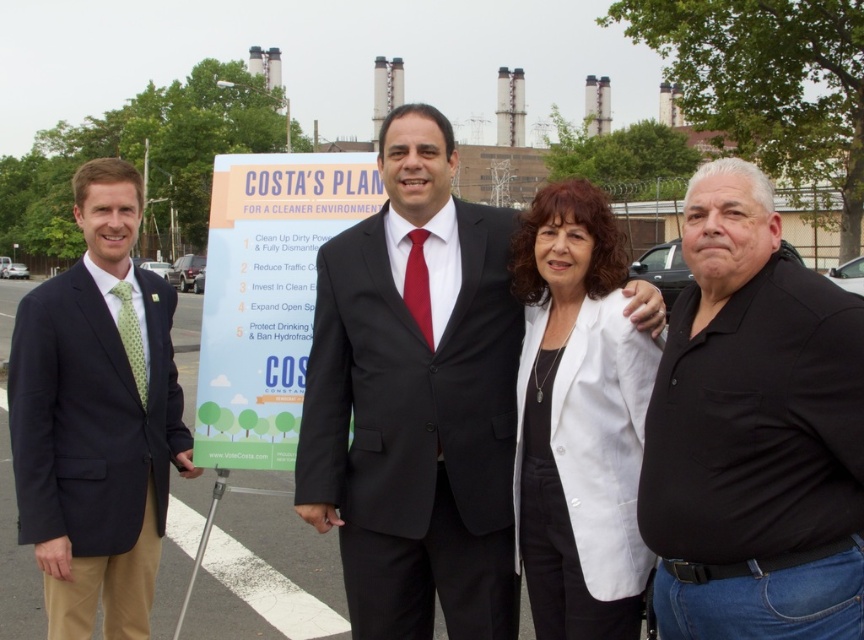
Consider the image. Which is below, matte black suit at center or black cotton polo shirt at right?

matte black suit at center is lower down.

Does matte black suit at center appear over black cotton polo shirt at right?

Actually, matte black suit at center is below black cotton polo shirt at right.

Between point (405, 314) and point (769, 628), which one is positioned in front?

Point (769, 628) is more forward.

The image size is (864, 640). I want to click on matte black suit at center, so click(x=416, y=400).

Which is behind, point (770, 588) or point (276, 458)?

Positioned behind is point (276, 458).

Between black cotton polo shirt at right and white paper sign at center, which one has more height?

With more height is white paper sign at center.

Is point (811, 508) farther from viewer compared to point (308, 230)?

That is False.

Where is `black cotton polo shirt at right`? This screenshot has height=640, width=864. black cotton polo shirt at right is located at coordinates (754, 433).

Is black cotton polo shirt at right to the right of matte green tie at left from the viewer's perspective?

Yes, black cotton polo shirt at right is to the right of matte green tie at left.

Can you confirm if black cotton polo shirt at right is shorter than matte green tie at left?

Yes.

Between point (764, 636) and point (68, 465), which one is positioned behind?

Point (68, 465)

The width and height of the screenshot is (864, 640). Find the location of `black cotton polo shirt at right`. black cotton polo shirt at right is located at coordinates (754, 433).